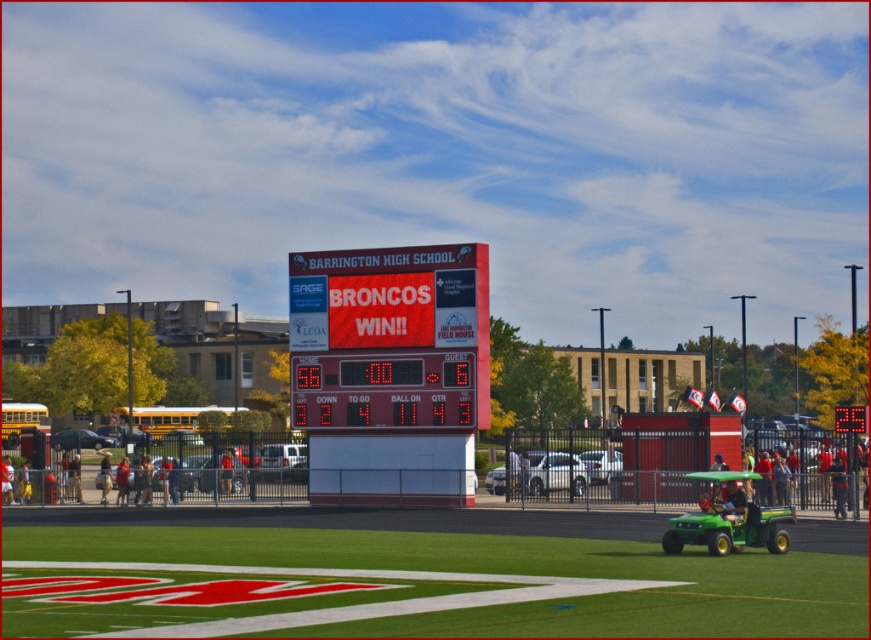
From the picture: You are a spectator at the football game and you want to find your friend who is wearing a red shirt at center. You are currently standing near the denim jacket at lower left. Which direction should you look to find your friend?

You should look upward because the denim jacket at lower left is positioned under the red shirt at center.

You are a player on the football field and you see two points marked on the field. The first point is at coordinate point (2, 474) and the second point is at coordinate point (224, 460). Which point is closer to you as you stand on the field?

Point (224, 460) is closer to you because it is in front of point (2, 474).